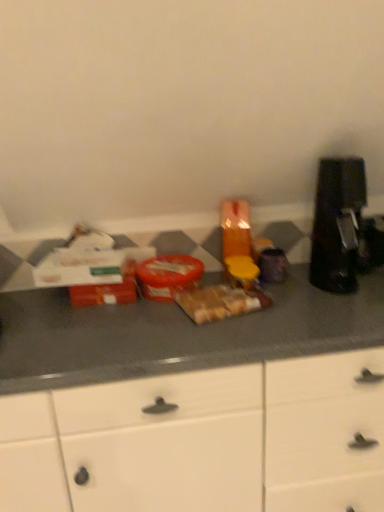
How much space does brown matte sandwich at center, positioned as the 1th food in right-to-left order, occupy vertically?

brown matte sandwich at center, positioned as the 1th food in right-to-left order, is 1.97 inches in height.

In order to click on black plastic coffee machine at right in this screenshot , I will do `click(337, 224)`.

Describe the element at coordinates (337, 224) in the screenshot. I see `black plastic coffee machine at right` at that location.

Locate an element on the screen. matte plastic container at center, placed as the 1th food when sorted from left to right is located at coordinates (168, 276).

From a real-world perspective, is black plastic coffee machine at right over white matte cabinet at center?

Yes, from a real-world perspective, black plastic coffee machine at right is over white matte cabinet at center

Looking at this image, is black plastic coffee machine at right not within white matte cabinet at center?

black plastic coffee machine at right is positioned outside white matte cabinet at center.

Is black plastic coffee machine at right taller than white matte cabinet at center?

In fact, black plastic coffee machine at right may be shorter than white matte cabinet at center.

From the image's perspective, between black plastic coffee machine at right and brown matte sandwich at center, marked as the second food in a left-to-right arrangement, who is located below?

From the image's view, brown matte sandwich at center, marked as the second food in a left-to-right arrangement, is below.

How much distance is there between black plastic coffee machine at right and brown matte sandwich at center, marked as the second food in a left-to-right arrangement?

39.99 centimeters.

Does black plastic coffee machine at right turn towards brown matte sandwich at center, marked as the second food in a left-to-right arrangement?

No, black plastic coffee machine at right is not aimed at brown matte sandwich at center, marked as the second food in a left-to-right arrangement.

Can you confirm if black plastic coffee machine at right is taller than brown matte sandwich at center, marked as the second food in a left-to-right arrangement?

Indeed, black plastic coffee machine at right has a greater height compared to brown matte sandwich at center, marked as the second food in a left-to-right arrangement.

Considering the positions of point (353, 208) and point (155, 277), is point (353, 208) closer or farther from the camera than point (155, 277)?

Point (353, 208) is positioned farther from the camera compared to point (155, 277).

Does black plastic coffee machine at right lie in front of matte plastic container at center, placed as the 1th food when sorted from left to right?

That is True.

From a real-world perspective, is black plastic coffee machine at right on top of matte plastic container at center, placed as the 1th food when sorted from left to right?

Yes, from a real-world perspective, black plastic coffee machine at right is on top of matte plastic container at center, placed as the 1th food when sorted from left to right.

How distant is black plastic coffee machine at right from matte plastic container at center, marked as the second food in a right-to-left arrangement?

The distance of black plastic coffee machine at right from matte plastic container at center, marked as the second food in a right-to-left arrangement, is 19.83 inches.

Measure the distance between matte plastic container at center, placed as the 1th food when sorted from left to right, and black plastic coffee machine at right.

A distance of 50.37 centimeters exists between matte plastic container at center, placed as the 1th food when sorted from left to right, and black plastic coffee machine at right.

From a real-world perspective, relative to black plastic coffee machine at right, is matte plastic container at center, marked as the second food in a right-to-left arrangement, vertically above or below?

matte plastic container at center, marked as the second food in a right-to-left arrangement, is below black plastic coffee machine at right.

Between matte plastic container at center, marked as the second food in a right-to-left arrangement, and black plastic coffee machine at right, which one has smaller size?

Smaller between the two is matte plastic container at center, marked as the second food in a right-to-left arrangement.

From a real-world perspective, which object rests below the other?

white matte cabinet at center.

Between white matte cabinet at center and brown matte sandwich at center, marked as the second food in a left-to-right arrangement, which one is positioned behind?

brown matte sandwich at center, marked as the second food in a left-to-right arrangement.

Starting from the white matte cabinet at center, which food is the 1st one behind? Please provide its 2D coordinates.

[(220, 302)]

Considering the relative sizes of white matte cabinet at center and brown matte sandwich at center, marked as the second food in a left-to-right arrangement, in the image provided, is white matte cabinet at center taller than brown matte sandwich at center, marked as the second food in a left-to-right arrangement,?

Yes.

Who is taller, brown matte sandwich at center, positioned as the 1th food in right-to-left order, or black plastic coffee machine at right?

Standing taller between the two is black plastic coffee machine at right.

Based on their sizes in the image, would you say brown matte sandwich at center, marked as the second food in a left-to-right arrangement, is bigger or smaller than black plastic coffee machine at right?

Considering their sizes, brown matte sandwich at center, marked as the second food in a left-to-right arrangement, takes up less space than black plastic coffee machine at right.

Is brown matte sandwich at center, positioned as the 1th food in right-to-left order, facing away from black plastic coffee machine at right?

No.

Which of these two, matte plastic container at center, marked as the second food in a right-to-left arrangement, or brown matte sandwich at center, marked as the second food in a left-to-right arrangement, is thinner?

brown matte sandwich at center, marked as the second food in a left-to-right arrangement, is thinner.

Which is closer to the camera, (183, 287) or (238, 288)?

Point (183, 287) is farther from the camera than point (238, 288).

Where is `food lying on the right of matte plastic container at center, marked as the second food in a right-to-left arrangement`? food lying on the right of matte plastic container at center, marked as the second food in a right-to-left arrangement is located at coordinates (220, 302).

Is matte plastic container at center, marked as the second food in a right-to-left arrangement, facing away from brown matte sandwich at center, positioned as the 1th food in right-to-left order?

matte plastic container at center, marked as the second food in a right-to-left arrangement, does not have its back to brown matte sandwich at center, positioned as the 1th food in right-to-left order.

Where is `cabinetry in front of the black plastic coffee machine at right`? cabinetry in front of the black plastic coffee machine at right is located at coordinates (203, 440).

At what (x,y) coordinates should I click in order to perform the action: click on the 1st food to the left of the black plastic coffee machine at right, counting from the anchor's position. Please return your answer as a coordinate pair (x, y). This screenshot has width=384, height=512. Looking at the image, I should click on (220, 302).

Considering their positions, is brown matte sandwich at center, marked as the second food in a left-to-right arrangement, positioned closer to black plastic coffee machine at right than matte plastic container at center, marked as the second food in a right-to-left arrangement?

brown matte sandwich at center, marked as the second food in a left-to-right arrangement.

Based on their spatial positions, is white matte cabinet at center or black plastic coffee machine at right closer to matte plastic container at center, placed as the 1th food when sorted from left to right?

white matte cabinet at center.

Considering their positions, is white matte cabinet at center positioned further to matte plastic container at center, marked as the second food in a right-to-left arrangement, than brown matte sandwich at center, positioned as the 1th food in right-to-left order?

white matte cabinet at center lies further to matte plastic container at center, marked as the second food in a right-to-left arrangement, than the other object.

Based on their spatial positions, is white matte cabinet at center or black plastic coffee machine at right closer to brown matte sandwich at center, positioned as the 1th food in right-to-left order?

white matte cabinet at center is positioned closer to the anchor brown matte sandwich at center, positioned as the 1th food in right-to-left order.

Estimate the real-world distances between objects in this image. Which object is further from brown matte sandwich at center, positioned as the 1th food in right-to-left order, black plastic coffee machine at right or white matte cabinet at center?

The object further to brown matte sandwich at center, positioned as the 1th food in right-to-left order, is black plastic coffee machine at right.

Looking at the image, which one is located closer to black plastic coffee machine at right, matte plastic container at center, marked as the second food in a right-to-left arrangement, or white matte cabinet at center?

Among the two, matte plastic container at center, marked as the second food in a right-to-left arrangement, is located nearer to black plastic coffee machine at right.

When comparing their distances from brown matte sandwich at center, positioned as the 1th food in right-to-left order, does white matte cabinet at center or matte plastic container at center, marked as the second food in a right-to-left arrangement, seem closer?

matte plastic container at center, marked as the second food in a right-to-left arrangement.

Based on their spatial positions, is white matte cabinet at center or matte plastic container at center, placed as the 1th food when sorted from left to right, closer to black plastic coffee machine at right?

matte plastic container at center, placed as the 1th food when sorted from left to right, is positioned closer to the anchor black plastic coffee machine at right.

At what (x,y) coordinates should I click in order to perform the action: click on food between matte plastic container at center, placed as the 1th food when sorted from left to right, and white matte cabinet at center, in the vertical direction. Please return your answer as a coordinate pair (x, y). This screenshot has width=384, height=512. Looking at the image, I should click on (220, 302).

What are the coordinates of `food between matte plastic container at center, marked as the second food in a right-to-left arrangement, and black plastic coffee machine at right, in the horizontal direction` in the screenshot? It's located at (220, 302).